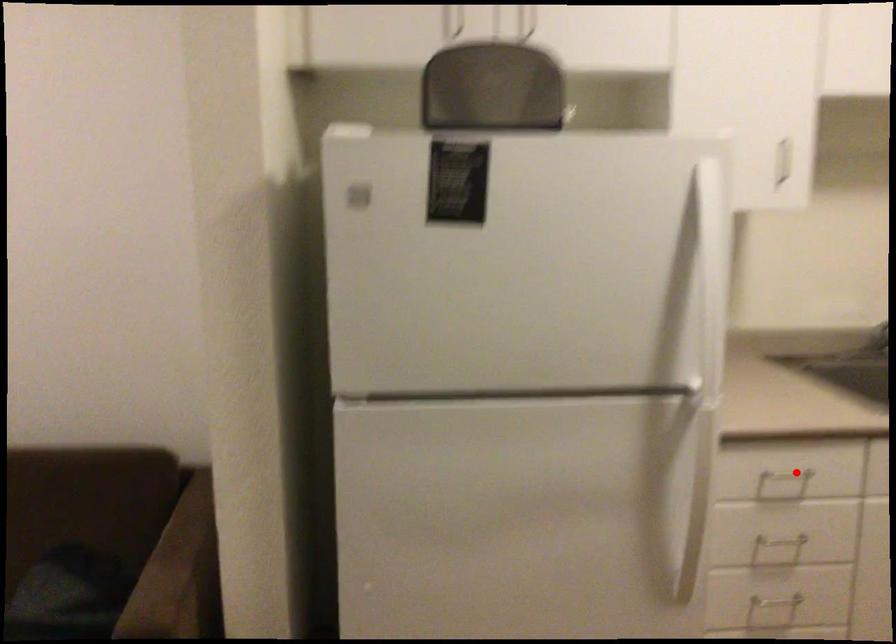
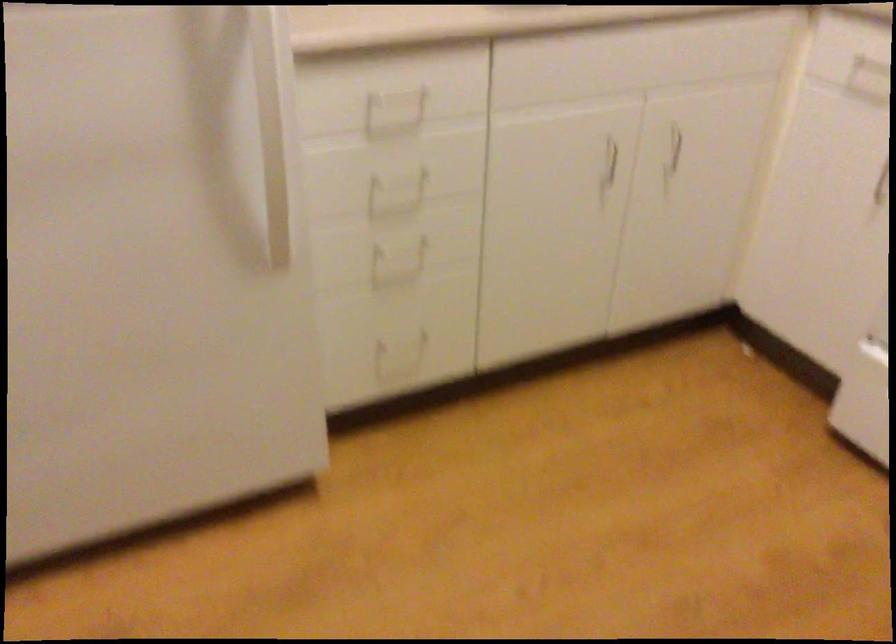
Question: I am providing you with two images of the same scene from different viewpoints. Given a red point in image1, look at the same physical point in image2. Is it:

Choices:
 (A) Closer to the viewpoint
 (B) Farther from the viewpoint

Answer: (A)